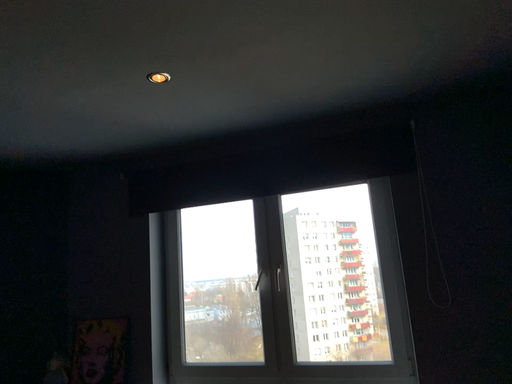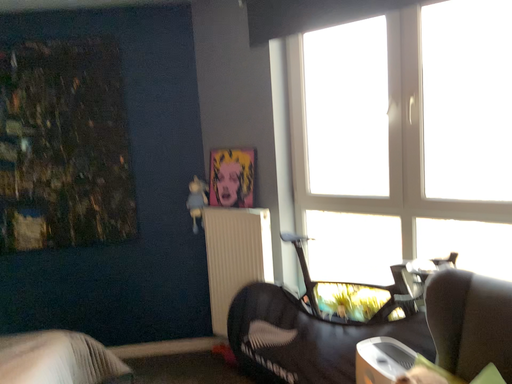
Question: Which way did the camera rotate in the video?

Choices:
 (A) rotated right
 (B) rotated left

Answer: (B)